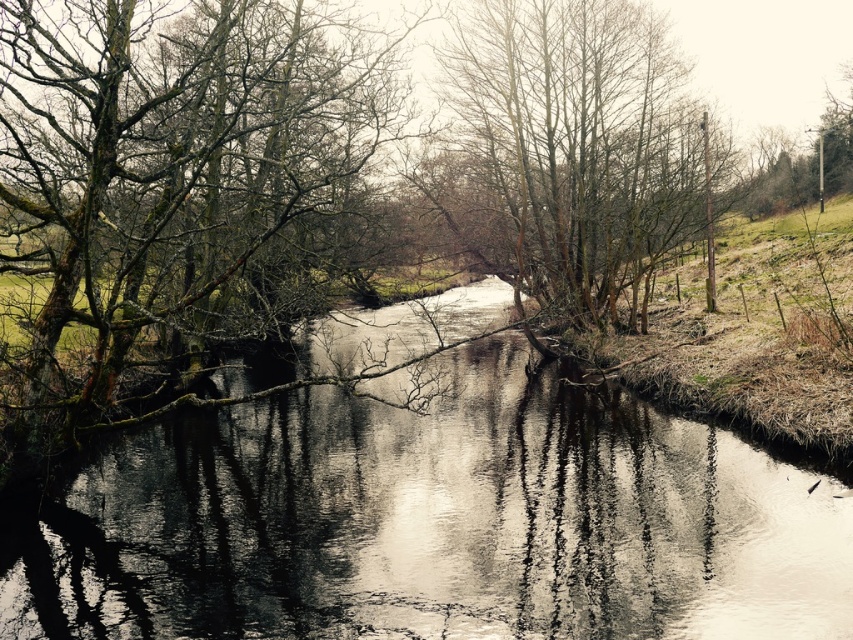
Question: Among these points, which one is farthest from the camera?

Choices:
 (A) (502, 52)
 (B) (663, 449)
 (C) (244, 147)

Answer: (A)

Question: Does reflective water at center appear under bare branches at center?

Choices:
 (A) no
 (B) yes

Answer: (B)

Question: Which of the following is the closest to the observer?

Choices:
 (A) (x=262, y=456)
 (B) (x=529, y=74)
 (C) (x=292, y=128)

Answer: (A)

Question: Does green mossy branches at left appear on the left side of bare branches at center?

Choices:
 (A) no
 (B) yes

Answer: (B)

Question: Does reflective water at center appear on the right side of green mossy branches at left?

Choices:
 (A) yes
 (B) no

Answer: (A)

Question: Which point appears farthest from the camera in this image?

Choices:
 (A) (450, 161)
 (B) (218, 54)

Answer: (A)